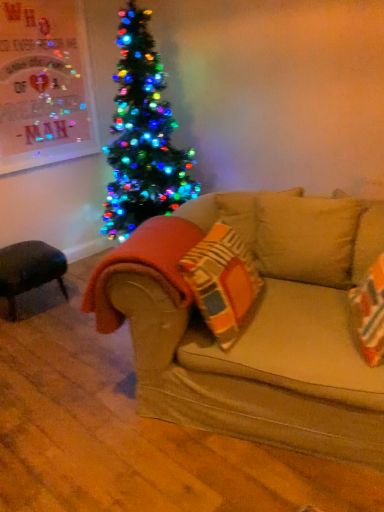
Question: From a real-world perspective, is black leather ottoman at lower left beneath orange fuzzy blanket at lower left?

Choices:
 (A) no
 (B) yes

Answer: (B)

Question: Is black leather ottoman at lower left smaller than orange fuzzy blanket at lower left?

Choices:
 (A) no
 (B) yes

Answer: (A)

Question: Would you say orange fuzzy blanket at lower left is part of black leather ottoman at lower left's contents?

Choices:
 (A) no
 (B) yes

Answer: (A)

Question: Can you confirm if black leather ottoman at lower left is taller than orange fuzzy blanket at lower left?

Choices:
 (A) no
 (B) yes

Answer: (A)

Question: From a real-world perspective, is black leather ottoman at lower left physically above orange fuzzy blanket at lower left?

Choices:
 (A) yes
 (B) no

Answer: (B)

Question: In the image, is orange fuzzy blanket at lower left positioned in front of or behind black leather ottoman at lower left?

Choices:
 (A) behind
 (B) front

Answer: (B)

Question: Is point (130, 245) positioned closer to the camera than point (8, 307)?

Choices:
 (A) closer
 (B) farther

Answer: (A)

Question: Considering the positions of orange fuzzy blanket at lower left and black leather ottoman at lower left in the image, is orange fuzzy blanket at lower left bigger or smaller than black leather ottoman at lower left?

Choices:
 (A) big
 (B) small

Answer: (B)

Question: From the image's perspective, is orange fuzzy blanket at lower left above or below black leather ottoman at lower left?

Choices:
 (A) below
 (B) above

Answer: (B)

Question: Considering the positions of beige fabric couch at center and black leather ottoman at lower left in the image, is beige fabric couch at center wider or thinner than black leather ottoman at lower left?

Choices:
 (A) wide
 (B) thin

Answer: (A)

Question: In terms of height, does beige fabric couch at center look taller or shorter compared to black leather ottoman at lower left?

Choices:
 (A) short
 (B) tall

Answer: (A)

Question: Relative to black leather ottoman at lower left, is beige fabric couch at center in front or behind?

Choices:
 (A) behind
 (B) front

Answer: (B)

Question: Is beige fabric couch at center inside or outside of black leather ottoman at lower left?

Choices:
 (A) inside
 (B) outside

Answer: (B)

Question: Is point (127, 270) positioned closer to the camera than point (192, 398)?

Choices:
 (A) closer
 (B) farther

Answer: (A)

Question: From a real-world perspective, relative to beige fabric couch at center, is orange fuzzy blanket at lower left vertically above or below?

Choices:
 (A) above
 (B) below

Answer: (A)